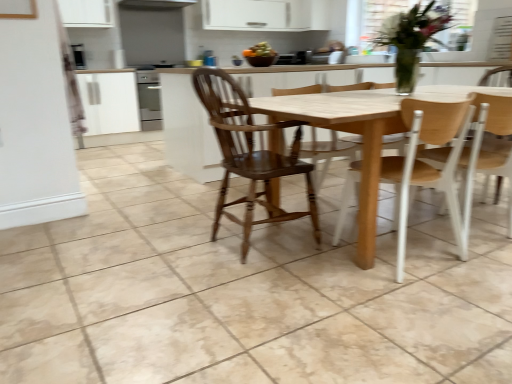
In order to click on vacant space positioned to the left of wooden chair at center, marked as the second chair in a left-to-right arrangement in this screenshot , I will do `click(321, 261)`.